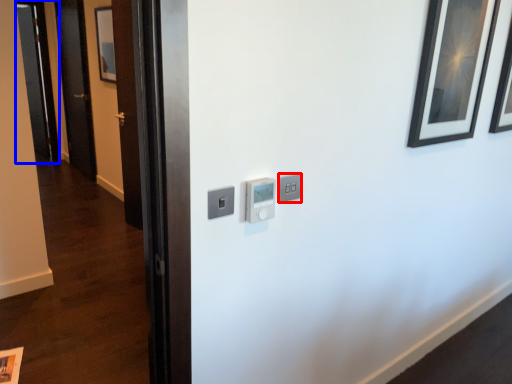
Question: Which of the following is the closest to the observer, light switch (highlighted by a red box) or glass door (highlighted by a blue box)?

Choices:
 (A) light switch
 (B) glass door

Answer: (A)